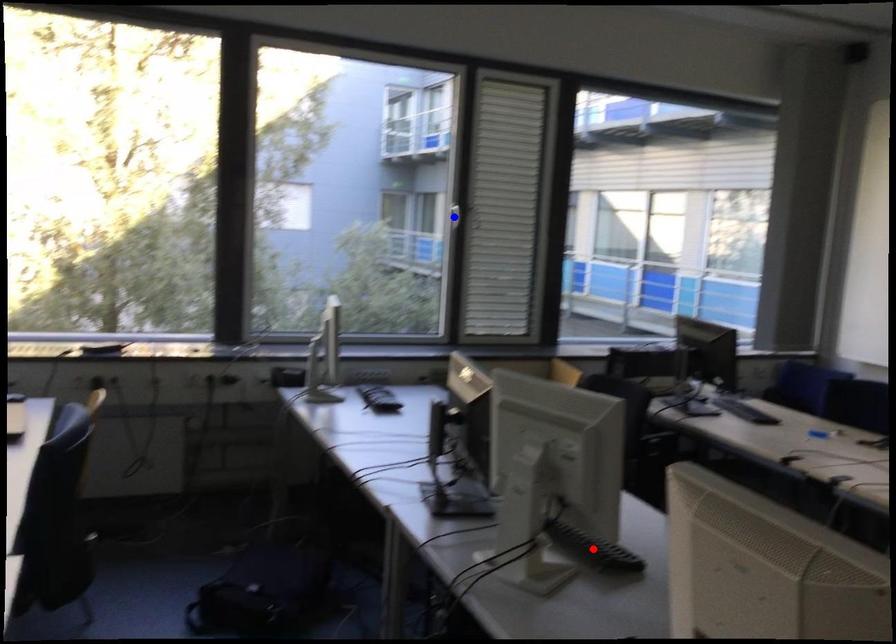
Question: Which of the two points in the image is closer to the camera?

Choices:
 (A) Blue point is closer.
 (B) Red point is closer.

Answer: (B)